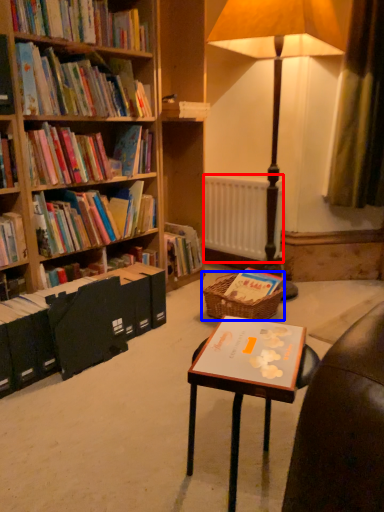
Question: Which point is closer to the camera, radiator (highlighted by a red box) or picnic basket (highlighted by a blue box)?

Choices:
 (A) radiator
 (B) picnic basket

Answer: (B)